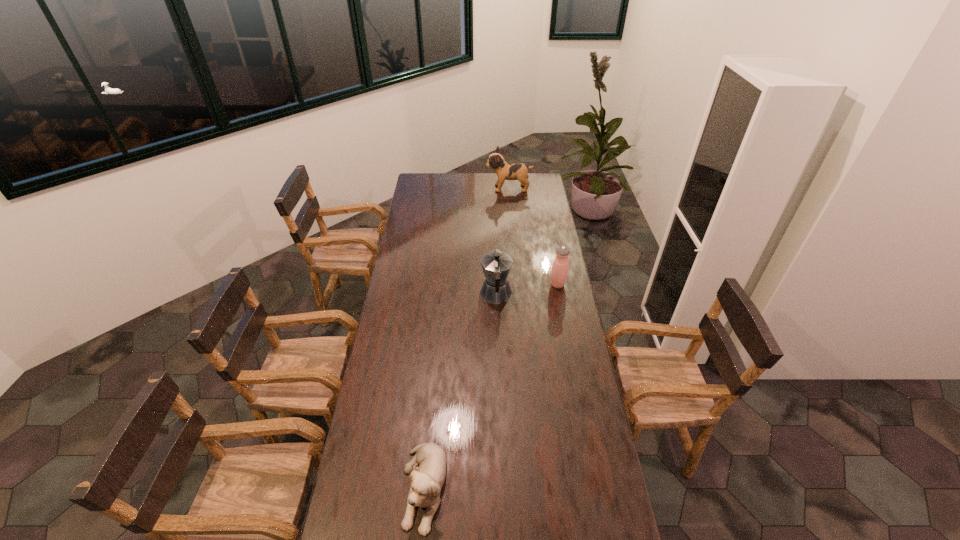
Find the location of a particular element. This screenshot has width=960, height=540. free space that satisfies the following two spatial constraints: 1. at the face of the taller puppy; 2. on the right side of the rightmost object is located at coordinates (517, 285).